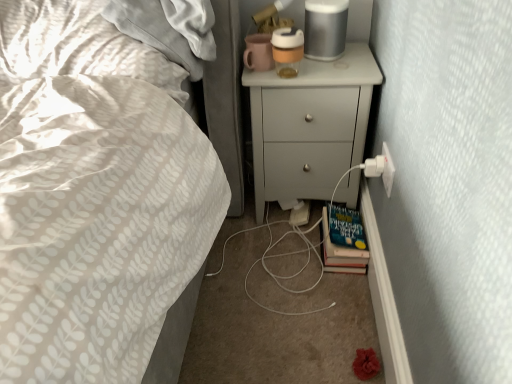
Question: Does hardcover book at lower right have a greater width compared to white plastic electric outlet at lower right?

Choices:
 (A) yes
 (B) no

Answer: (A)

Question: Does hardcover book at lower right have a lesser height compared to white plastic electric outlet at lower right?

Choices:
 (A) yes
 (B) no

Answer: (B)

Question: Is white plastic electric outlet at lower right completely or partially inside hardcover book at lower right?

Choices:
 (A) yes
 (B) no

Answer: (B)

Question: Does hardcover book at lower right appear on the right side of white plastic electric outlet at lower right?

Choices:
 (A) no
 (B) yes

Answer: (A)

Question: Is hardcover book at lower right not near white plastic electric outlet at lower right?

Choices:
 (A) yes
 (B) no

Answer: (B)

Question: Is hardcover book at lower right positioned beyond the bounds of white plastic electric outlet at lower right?

Choices:
 (A) yes
 (B) no

Answer: (A)

Question: Does white matte chest of drawers at upper right turn towards white plastic electric outlet at lower right?

Choices:
 (A) no
 (B) yes

Answer: (B)

Question: From a real-world perspective, is white matte chest of drawers at upper right below white plastic electric outlet at lower right?

Choices:
 (A) no
 (B) yes

Answer: (B)

Question: Is white matte chest of drawers at upper right far away from white plastic electric outlet at lower right?

Choices:
 (A) no
 (B) yes

Answer: (A)

Question: Is white matte chest of drawers at upper right facing away from white plastic electric outlet at lower right?

Choices:
 (A) no
 (B) yes

Answer: (A)

Question: Is white matte chest of drawers at upper right bigger than white plastic electric outlet at lower right?

Choices:
 (A) yes
 (B) no

Answer: (A)

Question: Considering the relative sizes of white matte chest of drawers at upper right and white plastic electric outlet at lower right in the image provided, is white matte chest of drawers at upper right wider than white plastic electric outlet at lower right?

Choices:
 (A) no
 (B) yes

Answer: (B)

Question: Is white plastic electric outlet at lower right at the left side of hardcover book at lower right?

Choices:
 (A) no
 (B) yes

Answer: (A)